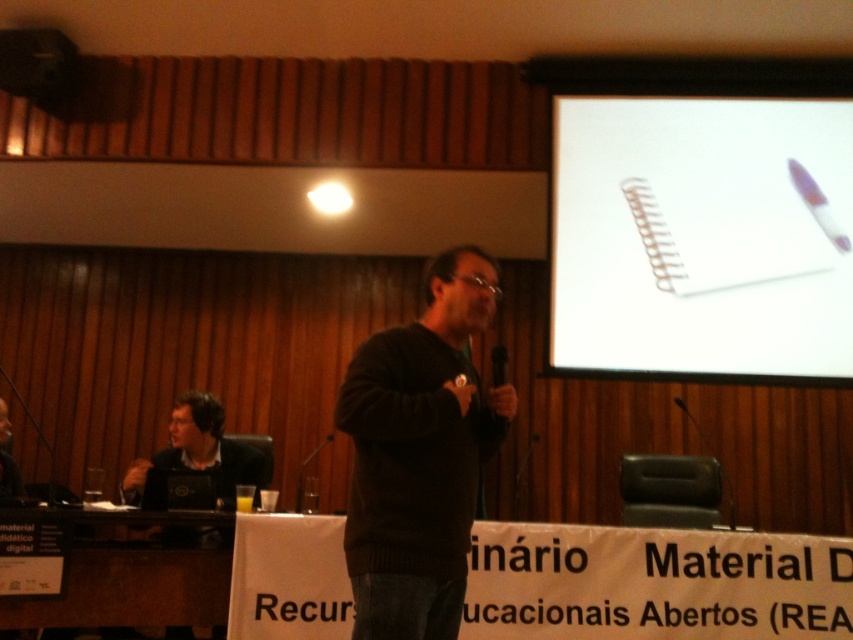
Question: Can you confirm if dark brown sweater at center is positioned to the right of matte black laptop at lower left?

Choices:
 (A) no
 (B) yes

Answer: (B)

Question: Does white paper at upper right have a larger size compared to matte black laptop at lower left?

Choices:
 (A) yes
 (B) no

Answer: (A)

Question: Which is farther from the matte black laptop at lower left?

Choices:
 (A) dark brown sweater at center
 (B) matte black laptop at upper left

Answer: (B)

Question: Among these objects, which one is nearest to the camera?

Choices:
 (A) matte black laptop at lower left
 (B) white paper at upper right
 (C) matte black laptop at upper left
 (D) dark brown sweater at center

Answer: (D)

Question: Does white paper at upper right have a smaller size compared to dark brown sweater at center?

Choices:
 (A) yes
 (B) no

Answer: (B)

Question: Among these points, which one is nearest to the camera?

Choices:
 (A) (641, 186)
 (B) (222, 464)

Answer: (A)